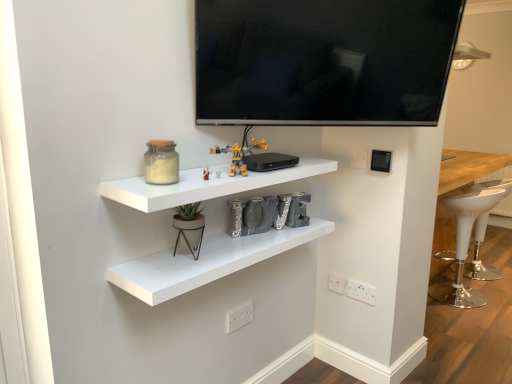
Question: Is white plastic electric outlet at lower center, the second electric outlet viewed from the front, positioned behind white matte shelf at center, the 1th shelf when ordered from top to bottom?

Choices:
 (A) no
 (B) yes

Answer: (B)

Question: From a real-world perspective, is white plastic electric outlet at lower center, which is counted as the first electric outlet, starting from the top, located higher than white matte shelf at center, the 1th shelf when ordered from top to bottom?

Choices:
 (A) no
 (B) yes

Answer: (B)

Question: Could you tell me if white plastic electric outlet at lower center, which is the third electric outlet from left to right, is turned towards white matte shelf at center, the 1th shelf when ordered from top to bottom?

Choices:
 (A) yes
 (B) no

Answer: (A)

Question: Is white matte shelf at center, the 1th shelf when ordered from top to bottom, located within white plastic electric outlet at lower center, which is the third electric outlet from left to right?

Choices:
 (A) no
 (B) yes

Answer: (A)

Question: Considering the relative sizes of white plastic electric outlet at lower center, which ranks as the 4th electric outlet in bottom-to-top order, and white matte shelf at center, the 1th shelf when ordered from top to bottom, in the image provided, is white plastic electric outlet at lower center, which ranks as the 4th electric outlet in bottom-to-top order, wider than white matte shelf at center, the 1th shelf when ordered from top to bottom,?

Choices:
 (A) yes
 (B) no

Answer: (B)

Question: From a real-world perspective, relative to flat screen tv at upper center, is translucent glass jar at upper left vertically above or below?

Choices:
 (A) above
 (B) below

Answer: (B)

Question: Considering the positions of translucent glass jar at upper left and flat screen tv at upper center in the image, is translucent glass jar at upper left bigger or smaller than flat screen tv at upper center?

Choices:
 (A) small
 (B) big

Answer: (A)

Question: Considering the positions of translucent glass jar at upper left and flat screen tv at upper center in the image, is translucent glass jar at upper left taller or shorter than flat screen tv at upper center?

Choices:
 (A) tall
 (B) short

Answer: (B)

Question: Is translucent glass jar at upper left spatially inside flat screen tv at upper center, or outside of it?

Choices:
 (A) outside
 (B) inside

Answer: (A)

Question: From a real-world perspective, relative to translucent glass jar at upper left, is white plastic bar stool at right, marked as the 1th bar stool in a left-to-right arrangement, vertically above or below?

Choices:
 (A) below
 (B) above

Answer: (A)

Question: From their relative heights in the image, would you say white plastic bar stool at right, marked as the 1th bar stool in a left-to-right arrangement, is taller or shorter than translucent glass jar at upper left?

Choices:
 (A) tall
 (B) short

Answer: (A)

Question: Is white plastic bar stool at right, marked as the 1th bar stool in a left-to-right arrangement, bigger or smaller than translucent glass jar at upper left?

Choices:
 (A) big
 (B) small

Answer: (A)

Question: Would you say white plastic bar stool at right, marked as the 1th bar stool in a left-to-right arrangement, is to the left or to the right of translucent glass jar at upper left in the picture?

Choices:
 (A) right
 (B) left

Answer: (A)

Question: In terms of size, does white plastic electric outlet at lower center, positioned as the 3th electric outlet in bottom-to-top order, appear bigger or smaller than white plastic electric outlet at lower center, the 1th electric outlet positioned from the front?

Choices:
 (A) small
 (B) big

Answer: (A)

Question: Is white plastic electric outlet at lower center, positioned as the 3th electric outlet in bottom-to-top order, wider or thinner than white plastic electric outlet at lower center, which appears as the fourth electric outlet when viewed from the right?

Choices:
 (A) thin
 (B) wide

Answer: (A)